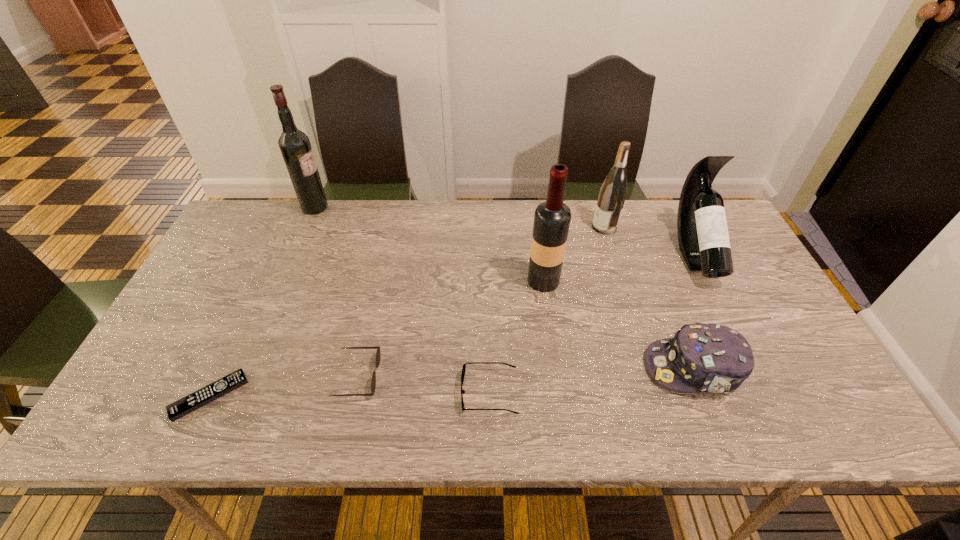
Locate an element on the screen. vacant space situated on the front-facing side of the fourth object from left to right is located at coordinates (x=396, y=392).

Locate an element on the screen. This screenshot has height=540, width=960. free space located 0.300m on the front-facing side of the fourth object from left to right is located at coordinates (330, 392).

Locate an element on the screen. The width and height of the screenshot is (960, 540). blank area located on the back of the shortest object is located at coordinates (249, 313).

Find the location of a particular element. The width and height of the screenshot is (960, 540). headwear situated at the near edge is located at coordinates (713, 358).

Where is `sunglasses that is at the near edge`? Image resolution: width=960 pixels, height=540 pixels. sunglasses that is at the near edge is located at coordinates (378, 354).

Where is `spectacles positioned at the near edge`? spectacles positioned at the near edge is located at coordinates (464, 365).

Find the location of `remote control that is at the near edge`. remote control that is at the near edge is located at coordinates (176, 410).

Where is `object that is at the left edge`? object that is at the left edge is located at coordinates (176, 410).

The image size is (960, 540). What are the coordinates of `object located at the right edge` in the screenshot? It's located at (703, 237).

At what (x,y) coordinates should I click in order to perform the action: click on object present at the near left corner. Please return your answer as a coordinate pair (x, y). The height and width of the screenshot is (540, 960). Looking at the image, I should click on [x=176, y=410].